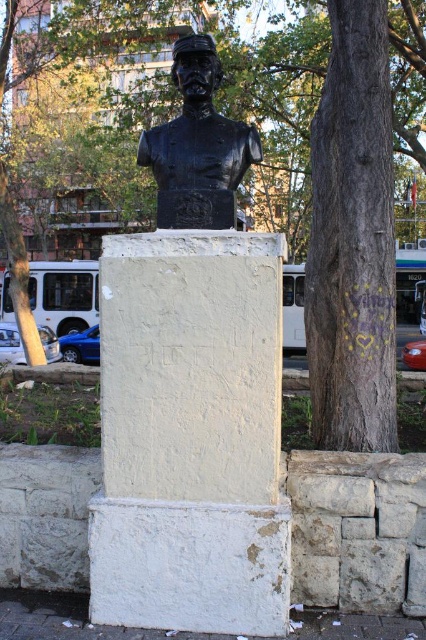
Does green textured tree at center right have a lesser width compared to black bronze bust at center?

No, green textured tree at center right is not thinner than black bronze bust at center.

Based on the photo, is green textured tree at center right positioned behind black bronze bust at center?

Yes, green textured tree at center right is further from the viewer.

Between point (389, 22) and point (209, 128), which one is positioned in front?

Point (209, 128)

Find the location of a particular element. green textured tree at center right is located at coordinates (275, 67).

Who is positioned more to the right, black polished bust at center or green textured tree at center right?

green textured tree at center right is more to the right.

Between black polished bust at center and green textured tree at center right, which one is positioned lower?

black polished bust at center is below.

Is point (224, 164) behind point (302, 97)?

No, (224, 164) is in front of (302, 97).

Identify the location of black polished bust at center. (192, 388).

Is black polished bust at center thinner than black bronze bust at center?

Incorrect, black polished bust at center's width is not less than black bronze bust at center's.

Who is lower down, black polished bust at center or black bronze bust at center?

Positioned lower is black polished bust at center.

Does point (161, 273) come in front of point (169, 131)?

Yes, point (161, 273) is closer to viewer.

Find the location of a particular element. This screenshot has height=640, width=426. black polished bust at center is located at coordinates (192, 388).